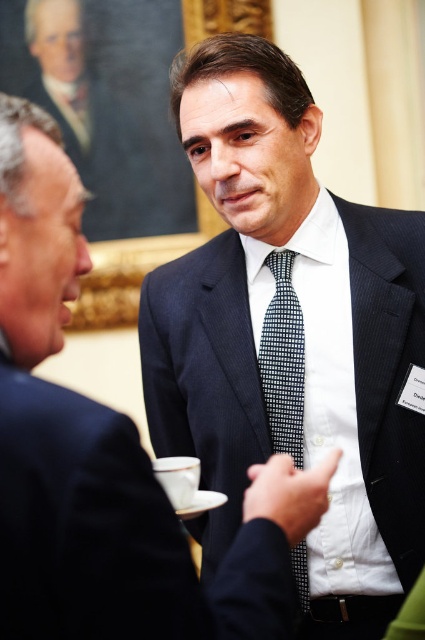
You are a fashion designer observing two men in a formal setting. You notice both are wearing suits at the center of the image. Which suit, the dark blue suit at center or the navy blue suit at center, appears taller on the men?

The dark blue suit at center appears taller than the navy blue suit at center.

You are a tailor trying to fit a customer for a new suit. You observe two suits in the image at the event. Based on the visual comparison between the dark blue suit at center and the navy wool suit at center, which one has a wider torso measurement?

The dark blue suit at center has a wider torso measurement than the navy wool suit at center, as its width surpasses the latter.

You are a photographer at a formal event. You want to take a photo of the two men in dark suits. The two men are the dark blue suit at center and the other man in a dark suit. How far apart are they?

The two men in dark suits are 7.73 feet apart.